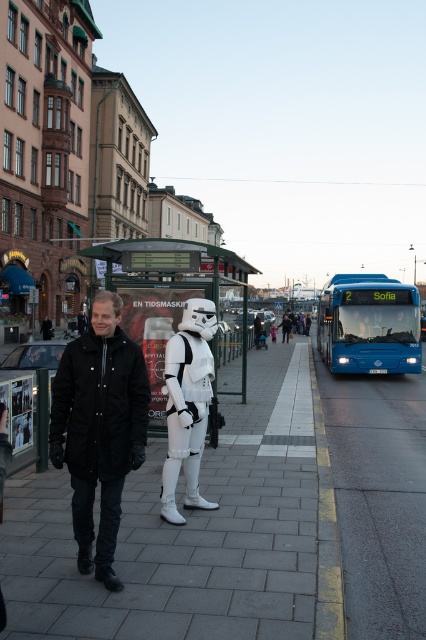
Is smooth concrete sidewalk at center to the left of white matte stormtrooper at center from the viewer's perspective?

Incorrect, smooth concrete sidewalk at center is not on the left side of white matte stormtrooper at center.

Does smooth concrete sidewalk at center appear on the right side of white matte stormtrooper at center?

Yes, smooth concrete sidewalk at center is to the right of white matte stormtrooper at center.

Locate an element on the screen. smooth concrete sidewalk at center is located at coordinates (184, 532).

Does smooth concrete sidewalk at center have a lesser height compared to black matte jacket at center?

Indeed, smooth concrete sidewalk at center has a lesser height compared to black matte jacket at center.

Which of these two, smooth concrete sidewalk at center or black matte jacket at center, stands taller?

Standing taller between the two is black matte jacket at center.

Is point (230, 426) closer to viewer compared to point (138, 388)?

That is False.

Identify the location of smooth concrete sidewalk at center. (184, 532).

Between point (3, 541) and point (393, 284), which one is positioned in front?

Point (3, 541)

Who is more distant from viewer, [244,497] or [333,307]?

Positioned behind is point [333,307].

Between point (299, 536) and point (344, 337), which one is positioned in front?

Positioned in front is point (299, 536).

The width and height of the screenshot is (426, 640). Identify the location of smooth concrete sidewalk at center. (184, 532).